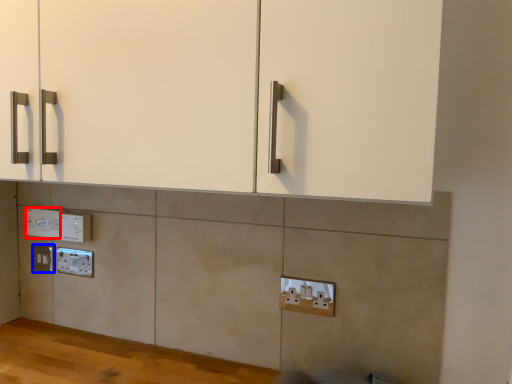
Question: Which of the following is the farthest to the observer, electric outlet (highlighted by a red box) or electric outlet (highlighted by a blue box)?

Choices:
 (A) electric outlet
 (B) electric outlet

Answer: (B)